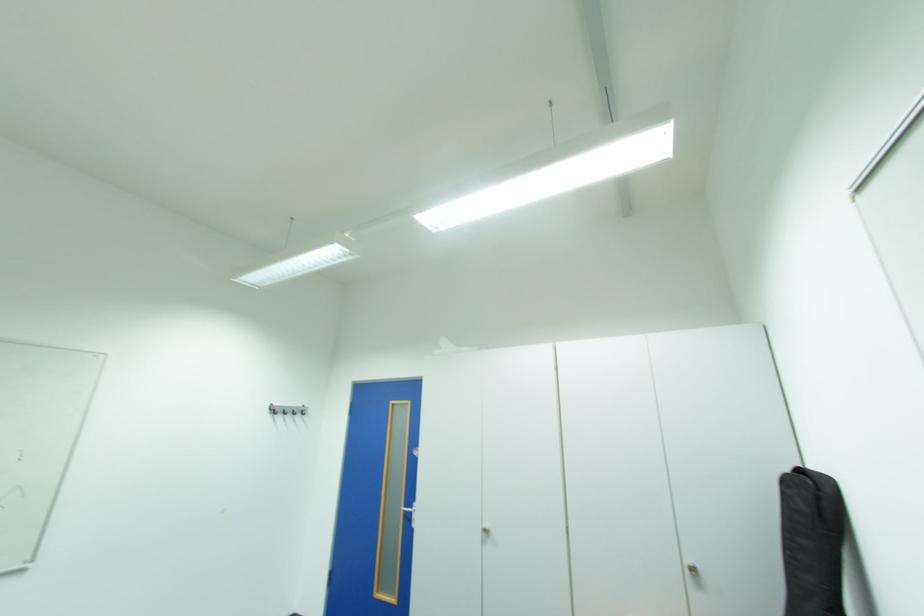
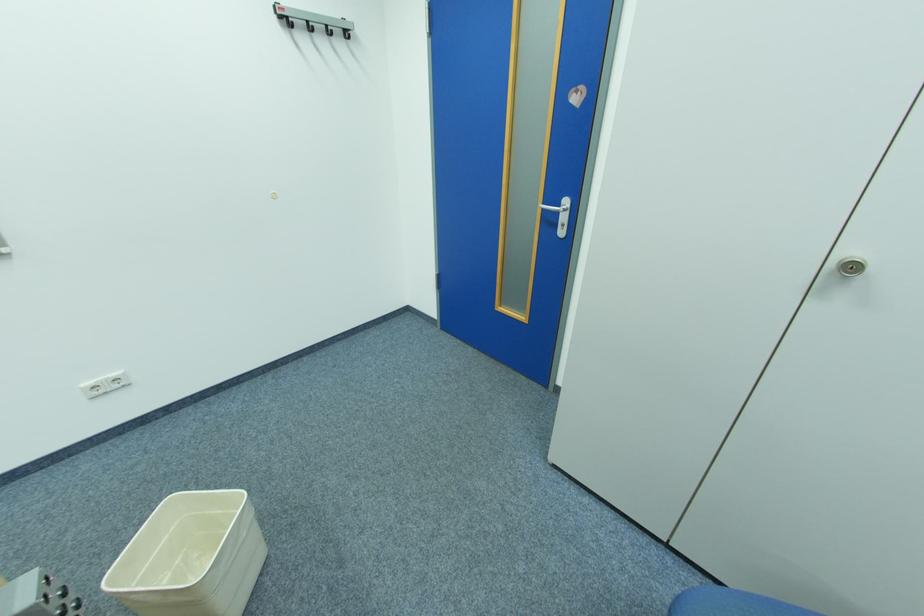
Find the pixel in the second image that matches pixel 280 411 in the first image.

(290, 25)